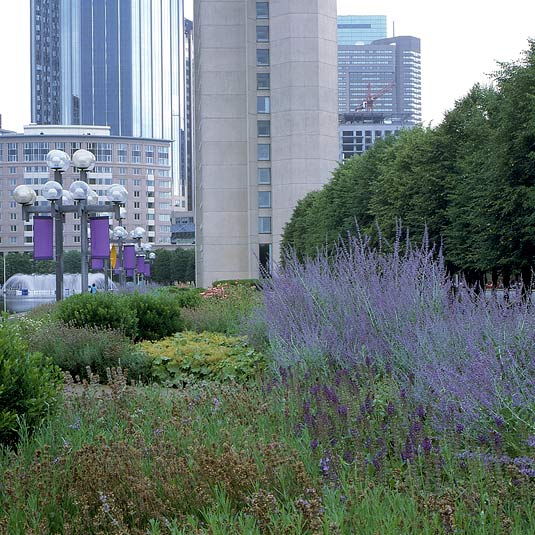
You are a GUI agent. You are given a task and a screenshot of the screen. Output one action in this format:
    pyautogui.click(x=<x>, y=<y>)
    Task: Click on the lights
    
    Given the screenshot: What is the action you would take?
    pyautogui.click(x=79, y=192), pyautogui.click(x=117, y=192), pyautogui.click(x=53, y=192), pyautogui.click(x=21, y=194), pyautogui.click(x=53, y=157), pyautogui.click(x=82, y=158)